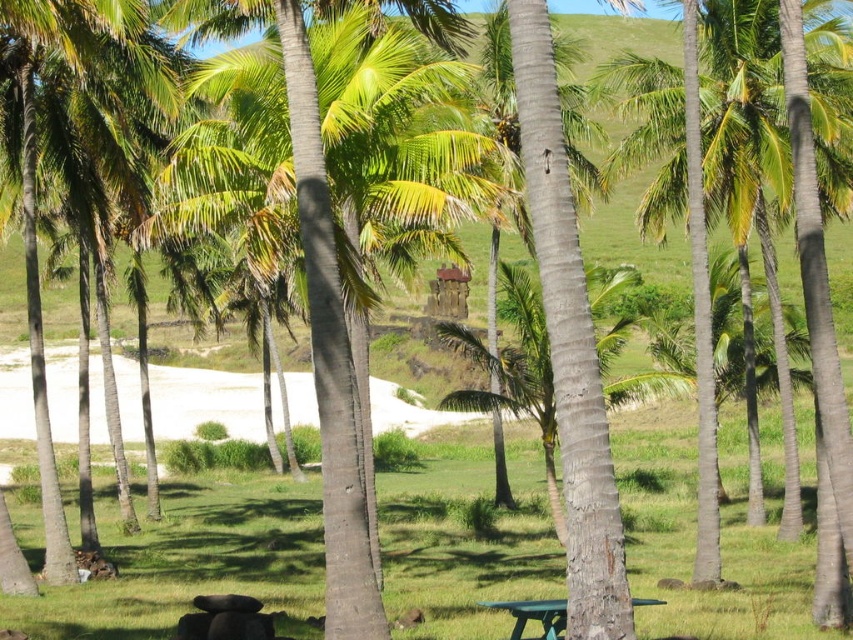
Who is taller, green leafy palm tree at center or green plastic picnic table at lower center?

Standing taller between the two is green leafy palm tree at center.

Between point (325, 333) and point (518, 612), which one is positioned in front?

Positioned in front is point (325, 333).

The width and height of the screenshot is (853, 640). I want to click on green leafy palm tree at center, so click(x=312, y=308).